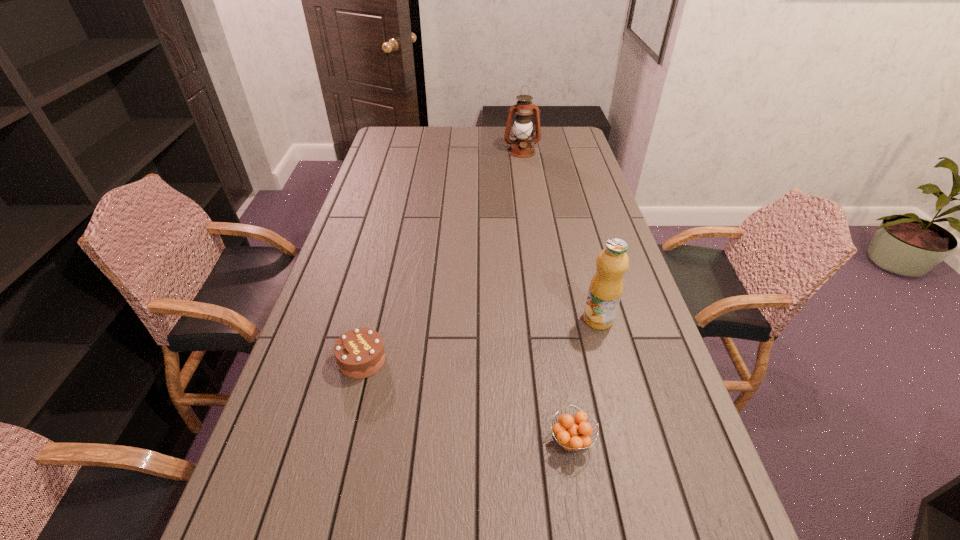
Locate an element on the screen. The height and width of the screenshot is (540, 960). vacant space located on the left of the orange fruit is located at coordinates (431, 440).

The width and height of the screenshot is (960, 540). In order to click on object present at the far edge in this screenshot , I will do `click(521, 147)`.

At what (x,y) coordinates should I click in order to perform the action: click on object located at the left edge. Please return your answer as a coordinate pair (x, y). This screenshot has width=960, height=540. Looking at the image, I should click on (359, 353).

Locate an element on the screen. The width and height of the screenshot is (960, 540). object present at the right edge is located at coordinates (606, 286).

The height and width of the screenshot is (540, 960). I want to click on vacant space at the far edge of the desktop, so click(464, 148).

Locate an element on the screen. This screenshot has height=540, width=960. free spot at the left edge of the desktop is located at coordinates (296, 503).

This screenshot has height=540, width=960. What are the coordinates of `vacant space at the right edge of the desktop` in the screenshot? It's located at (592, 183).

Where is `vacant space at the far left corner of the desktop`? vacant space at the far left corner of the desktop is located at coordinates (414, 135).

This screenshot has width=960, height=540. In order to click on free space that is in between the farthest object and the second farthest object in this screenshot , I will do `click(560, 235)`.

Identify the location of vacant area that lies between the fruit juice and the shortest object. (585, 380).